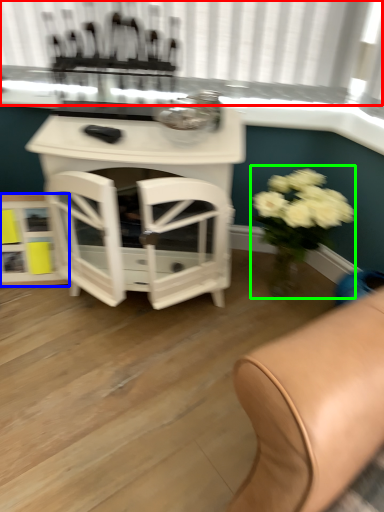
Question: Which is farther away from bay window (highlighted by a red box)? shelf (highlighted by a blue box) or floral arrangement (highlighted by a green box)?

Choices:
 (A) shelf
 (B) floral arrangement

Answer: (A)